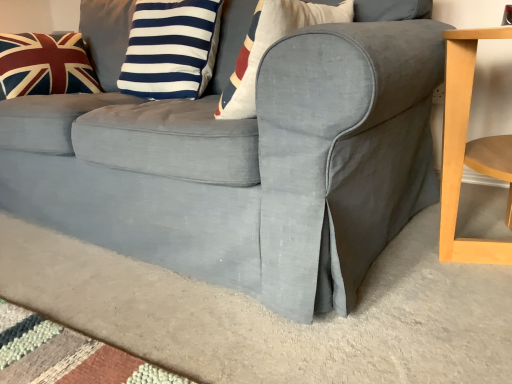
Question: Should I look upward or downward to see blue/white striped pillow at upper center, acting as the 1th pillow starting from the right?

Choices:
 (A) down
 (B) up

Answer: (B)

Question: Is union jack fabric pillow at upper left, the 2th pillow when ordered from right to left, completely or partially outside of blue/white striped pillow at upper center, the 2th pillow in the left-to-right sequence?

Choices:
 (A) yes
 (B) no

Answer: (A)

Question: From the image's perspective, would you say union jack fabric pillow at upper left, the 2th pillow when ordered from right to left, is shown under blue/white striped pillow at upper center, the 2th pillow in the left-to-right sequence?

Choices:
 (A) no
 (B) yes

Answer: (A)

Question: From a real-world perspective, is union jack fabric pillow at upper left, the 2th pillow when ordered from right to left, located beneath blue/white striped pillow at upper center, acting as the 1th pillow starting from the right?

Choices:
 (A) yes
 (B) no

Answer: (A)

Question: Is union jack fabric pillow at upper left, which ranks as the 1th pillow in left-to-right order, in contact with blue/white striped pillow at upper center, acting as the 1th pillow starting from the right?

Choices:
 (A) yes
 (B) no

Answer: (B)

Question: Is union jack fabric pillow at upper left, which ranks as the 1th pillow in left-to-right order, smaller than blue/white striped pillow at upper center, the 2th pillow in the left-to-right sequence?

Choices:
 (A) no
 (B) yes

Answer: (B)

Question: Is union jack fabric pillow at upper left, which ranks as the 1th pillow in left-to-right order, taller than blue/white striped pillow at upper center, acting as the 1th pillow starting from the right?

Choices:
 (A) no
 (B) yes

Answer: (A)

Question: Can you confirm if blue/white striped pillow at upper center, the 2th pillow in the left-to-right sequence, is taller than union jack fabric pillow at upper left, which ranks as the 1th pillow in left-to-right order?

Choices:
 (A) no
 (B) yes

Answer: (B)

Question: From a real-world perspective, does blue/white striped pillow at upper center, the 2th pillow in the left-to-right sequence, sit lower than union jack fabric pillow at upper left, which ranks as the 1th pillow in left-to-right order?

Choices:
 (A) yes
 (B) no

Answer: (B)

Question: From a real-world perspective, does blue/white striped pillow at upper center, acting as the 1th pillow starting from the right, stand above union jack fabric pillow at upper left, which ranks as the 1th pillow in left-to-right order?

Choices:
 (A) yes
 (B) no

Answer: (A)

Question: Considering the relative positions of blue/white striped pillow at upper center, the 2th pillow in the left-to-right sequence, and union jack fabric pillow at upper left, the 2th pillow when ordered from right to left, in the image provided, is blue/white striped pillow at upper center, the 2th pillow in the left-to-right sequence, to the left of union jack fabric pillow at upper left, the 2th pillow when ordered from right to left, from the viewer's perspective?

Choices:
 (A) no
 (B) yes

Answer: (A)

Question: Is blue/white striped pillow at upper center, acting as the 1th pillow starting from the right, to the right of union jack fabric pillow at upper left, the 2th pillow when ordered from right to left, from the viewer's perspective?

Choices:
 (A) yes
 (B) no

Answer: (A)

Question: Can you confirm if blue/white striped pillow at upper center, acting as the 1th pillow starting from the right, is wider than union jack fabric pillow at upper left, the 2th pillow when ordered from right to left?

Choices:
 (A) no
 (B) yes

Answer: (A)

Question: Considering the positions of blue/white striped pillow at upper center, acting as the 1th pillow starting from the right, and union jack fabric pillow at upper left, which ranks as the 1th pillow in left-to-right order, in the image, is blue/white striped pillow at upper center, acting as the 1th pillow starting from the right, taller or shorter than union jack fabric pillow at upper left, which ranks as the 1th pillow in left-to-right order,?

Choices:
 (A) tall
 (B) short

Answer: (A)